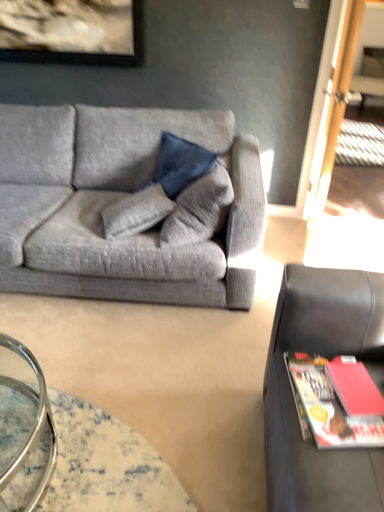
The image size is (384, 512). I want to click on free space above red matte magazine at right (from a real-world perspective), so click(x=336, y=394).